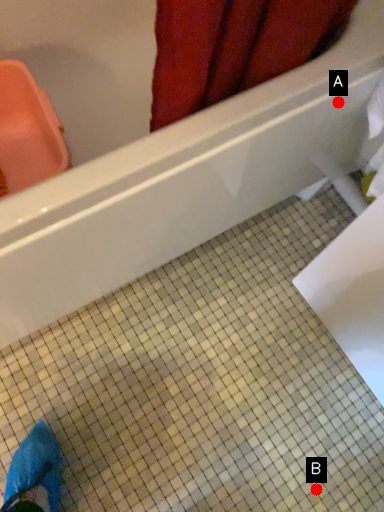
Question: Two points are circled on the image, labeled by A and B beside each circle. Which point is further to the camera?

Choices:
 (A) A is further
 (B) B is further

Answer: (B)